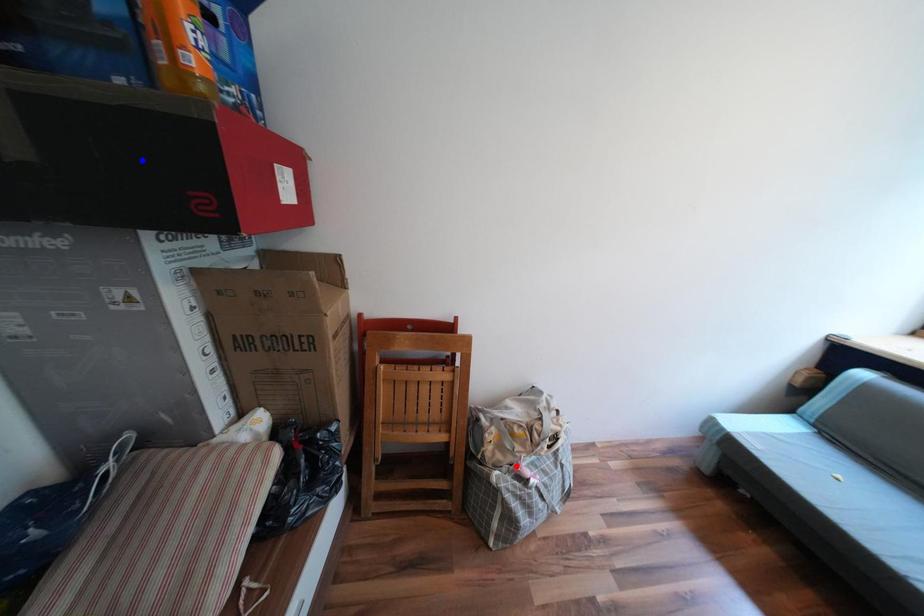
Question: In the image, two points are highlighted. Which point is nearer to the camera? Reply with the corresponding letter.

Choices:
 (A) blue point
 (B) red point

Answer: (A)